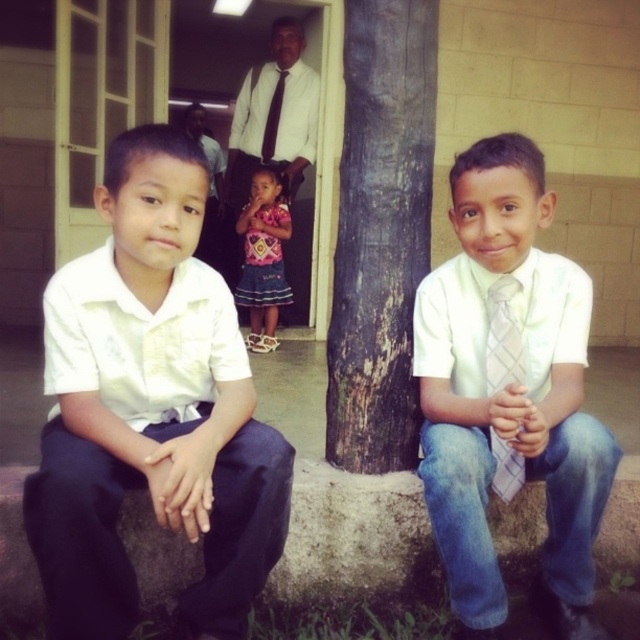
Is white woven tie at center thinner than black silk tie at upper center?

No, white woven tie at center is not thinner than black silk tie at upper center.

Is white woven tie at center above black silk tie at upper center?

No, white woven tie at center is not above black silk tie at upper center.

Does point (509, 198) lie in front of point (264, 144)?

That is True.

Find the location of a particular element. Image resolution: width=640 pixels, height=640 pixels. white woven tie at center is located at coordinates (508, 390).

Between pink fabric dress at center and white checkered tie at center, which one appears on the left side from the viewer's perspective?

From the viewer's perspective, pink fabric dress at center appears more on the left side.

What do you see at coordinates (262, 257) in the screenshot? The height and width of the screenshot is (640, 640). I see `pink fabric dress at center` at bounding box center [262, 257].

This screenshot has height=640, width=640. In order to click on pink fabric dress at center in this screenshot , I will do `click(262, 257)`.

Which is more to the right, white satin shirt at left or white checkered tie at center?

From the viewer's perspective, white checkered tie at center appears more on the right side.

Is white satin shirt at left bigger than white checkered tie at center?

Yes.

Find the location of a particular element. This screenshot has height=640, width=640. white satin shirt at left is located at coordinates (150, 408).